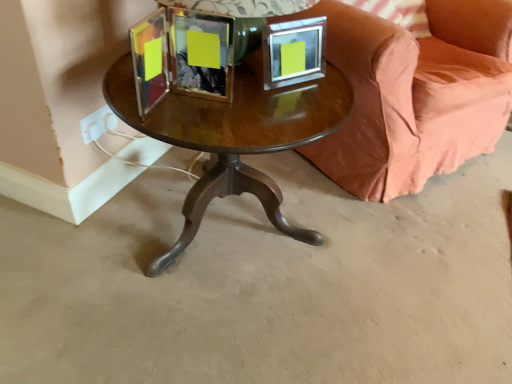
Identify the location of vacant space underneath shiny brown wood coffee table at center (from a real-world perspective). The image size is (512, 384). (233, 231).